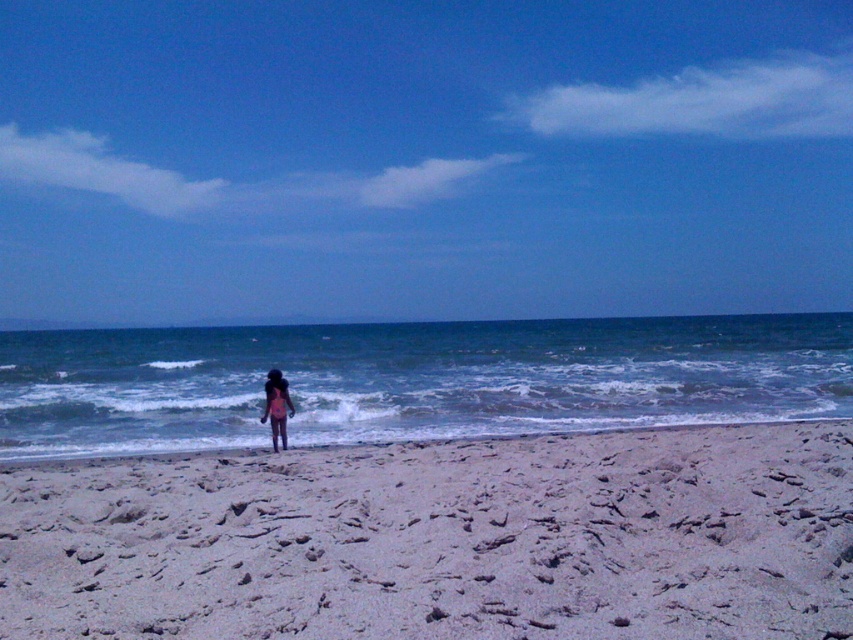
Question: Which of the following is the closest to the observer?

Choices:
 (A) (90, 557)
 (B) (268, 381)
 (C) (815, 397)

Answer: (A)

Question: Among these points, which one is farthest from the camera?

Choices:
 (A) (277, 420)
 (B) (770, 339)
 (C) (49, 522)

Answer: (B)

Question: Does blue water at center have a larger size compared to pink fabric bikini at center?

Choices:
 (A) no
 (B) yes

Answer: (B)

Question: Does fine-grained sand at center have a larger size compared to blue water at center?

Choices:
 (A) yes
 (B) no

Answer: (B)

Question: Does fine-grained sand at center appear on the left side of blue water at center?

Choices:
 (A) no
 (B) yes

Answer: (A)

Question: Estimate the real-world distances between objects in this image. Which object is closer to the pink fabric bikini at center?

Choices:
 (A) fine-grained sand at center
 (B) blue water at center

Answer: (A)